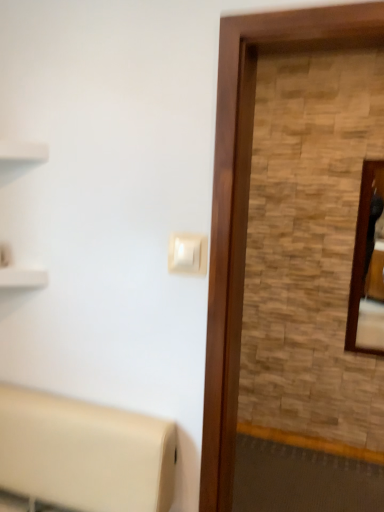
Question: Is wooden screen door at right not within wooden frame mirror at right?

Choices:
 (A) no
 (B) yes

Answer: (B)

Question: From a real-world perspective, does wooden screen door at right stand above wooden frame mirror at right?

Choices:
 (A) yes
 (B) no

Answer: (A)

Question: From a real-world perspective, is wooden screen door at right positioned under wooden frame mirror at right based on gravity?

Choices:
 (A) no
 (B) yes

Answer: (A)

Question: Is wooden frame mirror at right at the back of wooden screen door at right?

Choices:
 (A) yes
 (B) no

Answer: (A)

Question: Is wooden screen door at right at the right side of wooden frame mirror at right?

Choices:
 (A) yes
 (B) no

Answer: (B)

Question: From the image's perspective, is wooden frame mirror at right above or below wooden screen door at right?

Choices:
 (A) above
 (B) below

Answer: (A)

Question: From a real-world perspective, relative to wooden screen door at right, is wooden frame mirror at right vertically above or below?

Choices:
 (A) above
 (B) below

Answer: (B)

Question: In the image, is wooden frame mirror at right positioned in front of or behind wooden screen door at right?

Choices:
 (A) front
 (B) behind

Answer: (B)

Question: Is point (367, 249) closer or farther from the camera than point (329, 17)?

Choices:
 (A) closer
 (B) farther

Answer: (B)

Question: Is point (175, 270) positioned closer to the camera than point (372, 332)?

Choices:
 (A) closer
 (B) farther

Answer: (A)

Question: From a real-world perspective, is white plastic light switch at center physically located above or below wooden frame mirror at right?

Choices:
 (A) above
 (B) below

Answer: (A)

Question: Is white plastic light switch at center situated inside wooden frame mirror at right or outside?

Choices:
 (A) outside
 (B) inside

Answer: (A)

Question: Is white plastic light switch at center to the left or to the right of wooden frame mirror at right in the image?

Choices:
 (A) left
 (B) right

Answer: (A)

Question: Visually, is white plastic light switch at center positioned to the left or to the right of wooden screen door at right?

Choices:
 (A) left
 (B) right

Answer: (A)

Question: In terms of height, does white plastic light switch at center look taller or shorter compared to wooden screen door at right?

Choices:
 (A) tall
 (B) short

Answer: (B)